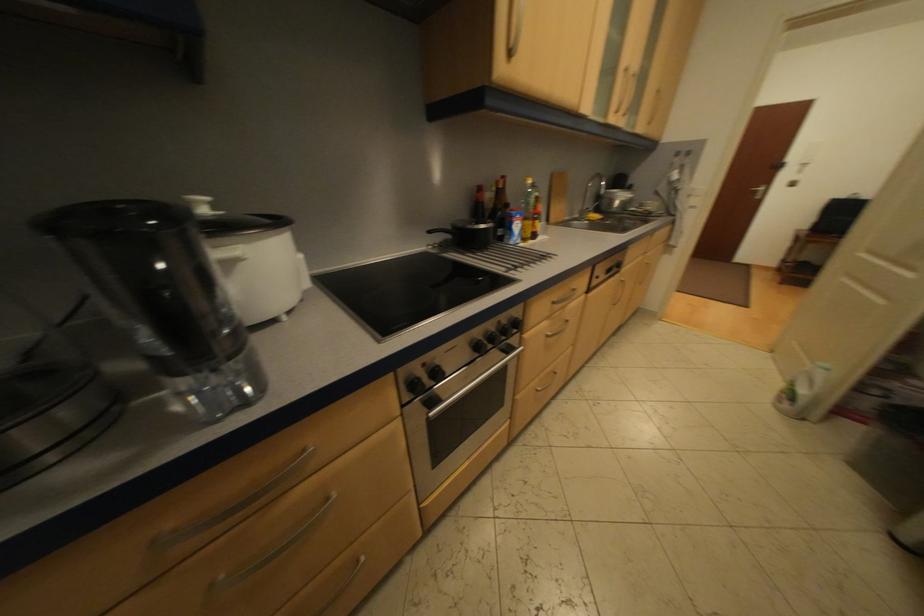
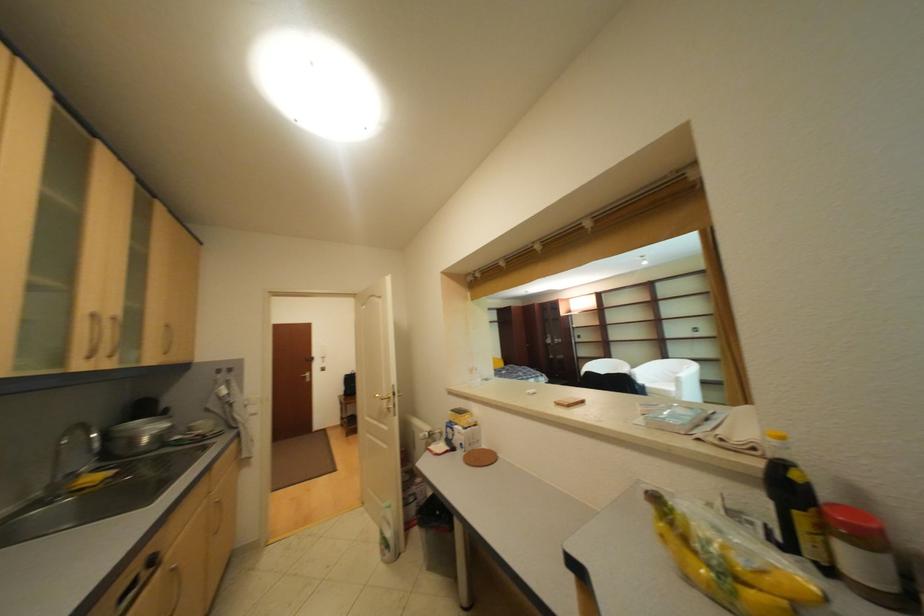
In the second image, find the point that corresponds to (x=611, y=177) in the first image.

(94, 428)